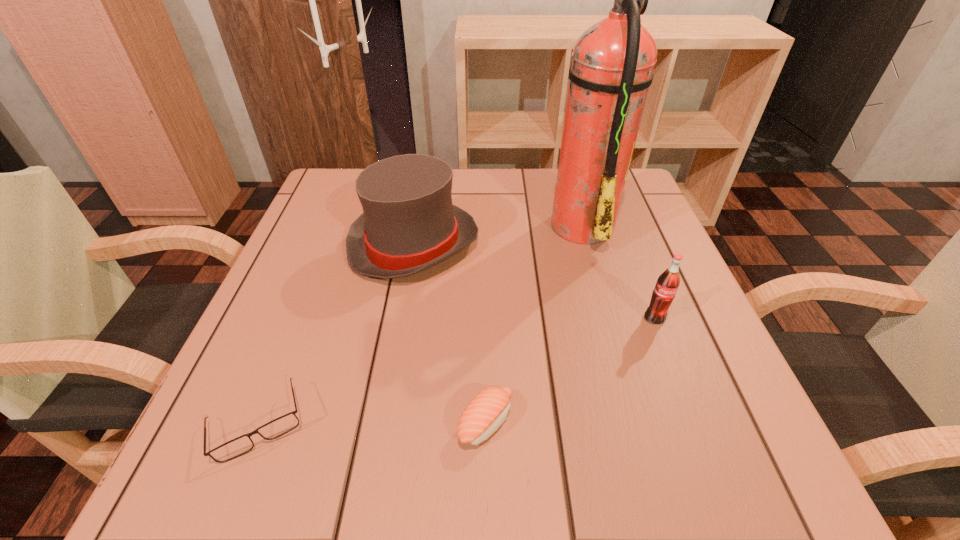
The height and width of the screenshot is (540, 960). What are the coordinates of `vacant space that's between the dress hat and the shortest object` in the screenshot? It's located at 336,334.

Locate an element on the screen. unoccupied area between the third nearest object and the dress hat is located at coordinates (535, 281).

Where is `blank region between the shortest object and the soda bottle`? The width and height of the screenshot is (960, 540). blank region between the shortest object and the soda bottle is located at coordinates (456, 372).

The width and height of the screenshot is (960, 540). What are the coordinates of `empty space that is in between the soda bottle and the fire extinguisher` in the screenshot? It's located at (618, 271).

This screenshot has width=960, height=540. Identify the location of blank region between the tallest object and the shortest object. (420, 323).

The image size is (960, 540). Find the location of `free space that is in between the third farthest object and the sushi`. free space that is in between the third farthest object and the sushi is located at coordinates (570, 370).

Where is `vacant point located between the shortest object and the soda bottle`? This screenshot has width=960, height=540. vacant point located between the shortest object and the soda bottle is located at coordinates point(456,372).

Identify the location of free space between the soda bottle and the fire extinguisher. (618, 271).

Identify the location of blank region between the dress hat and the fourth tallest object. The image size is (960, 540). (450, 333).

Select which object is the third closest to the tallest object. Please provide its 2D coordinates. Your answer should be formatted as a tuple, i.e. [(x, y)], where the tuple contains the x and y coordinates of a point satisfying the conditions above.

[(488, 410)]